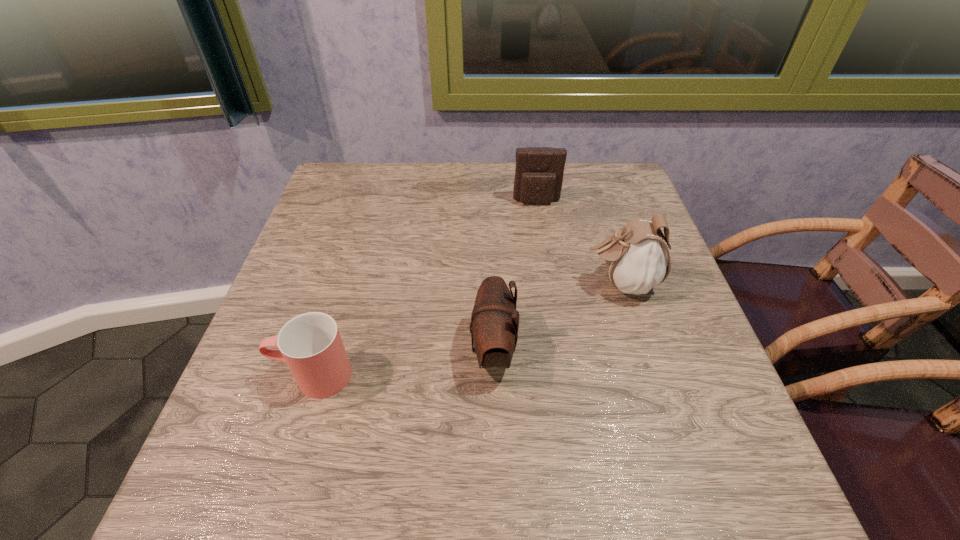
Image resolution: width=960 pixels, height=540 pixels. I want to click on the rightmost object, so click(x=637, y=257).

Identify the location of the tallest pouch. This screenshot has width=960, height=540. (637, 257).

Locate an element on the screen. The image size is (960, 540). the farthest object is located at coordinates (539, 171).

This screenshot has height=540, width=960. Identify the location of the third object from left to right. (539, 171).

Identify the location of the second object from left to right. (494, 320).

The height and width of the screenshot is (540, 960). Find the location of `the nearest pouch`. the nearest pouch is located at coordinates (494, 320).

Find the location of a particular element. The height and width of the screenshot is (540, 960). the leftmost object is located at coordinates (310, 344).

Find the location of `cup`. cup is located at coordinates (310, 344).

This screenshot has width=960, height=540. In order to click on vacant space situated 0.100m on the front-facing side of the rightmost pouch in this screenshot , I will do `click(537, 284)`.

The height and width of the screenshot is (540, 960). What are the coordinates of `vacant region located on the front-facing side of the rightmost pouch` in the screenshot? It's located at (522, 284).